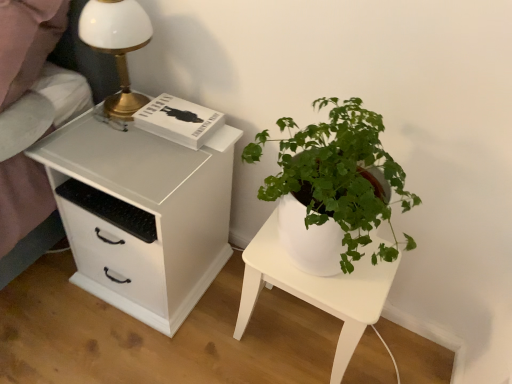
Question: From the image's perspective, is white glossy nightstand at lower right above or below white glossy table lamp at upper left?

Choices:
 (A) below
 (B) above

Answer: (A)

Question: Is point (243, 327) positioned closer to the camera than point (126, 24)?

Choices:
 (A) farther
 (B) closer

Answer: (A)

Question: Which is nearer to the white glossy nightstand at lower right?

Choices:
 (A) white matte chest of drawers at left
 (B) white glossy table lamp at upper left

Answer: (A)

Question: Which object is positioned closest to the white matte chest of drawers at left?

Choices:
 (A) white glossy table lamp at upper left
 (B) white glossy nightstand at lower right

Answer: (A)